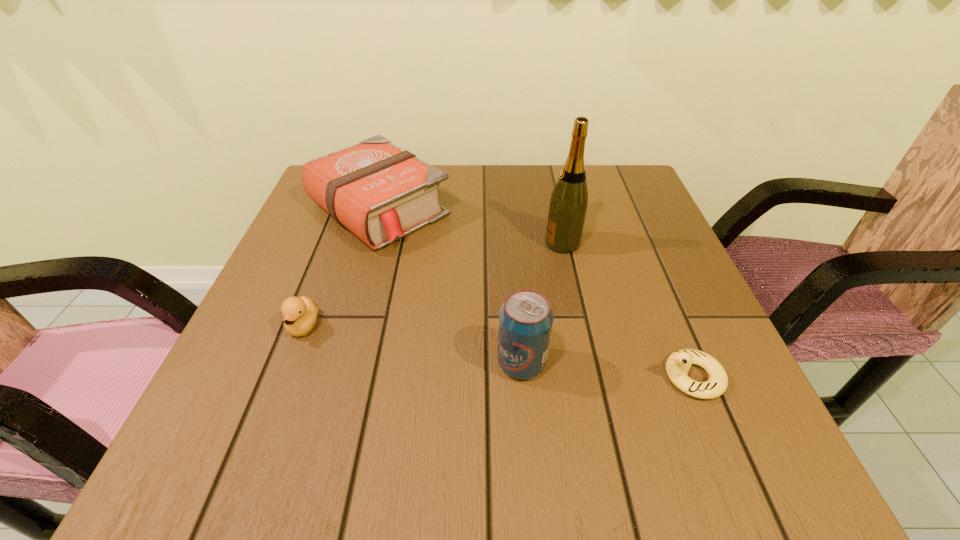
Find the location of a particular element. vacant space that satisfies the following two spatial constraints: 1. on the front-facing side of the second object from right to left; 2. facing forward on the third farthest object is located at coordinates (581, 326).